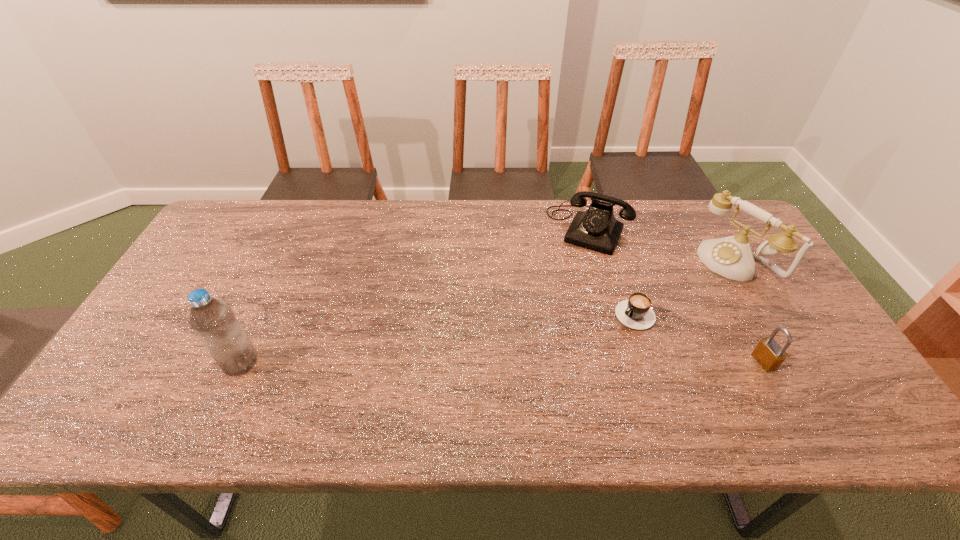
The image size is (960, 540). What are the coordinates of `vacant point located 0.110m on the dial of the right telephone` in the screenshot? It's located at (691, 293).

This screenshot has width=960, height=540. What are the coordinates of `free point located on the dial of the right telephone` in the screenshot? It's located at (703, 286).

Find the location of a particular element. vacant space located on the dial of the right telephone is located at coordinates (618, 340).

Where is `vacant space located on the front face of the left telephone`? This screenshot has height=540, width=960. vacant space located on the front face of the left telephone is located at coordinates (551, 308).

This screenshot has height=540, width=960. In order to click on vacant space located 0.050m on the front face of the left telephone in this screenshot , I will do `click(573, 263)`.

Locate an element on the screen. Image resolution: width=960 pixels, height=540 pixels. vacant space located 0.250m on the front face of the left telephone is located at coordinates (551, 308).

Find the location of a particular element. This screenshot has height=540, width=960. free space located 0.120m with the handle on the side of the third farthest object is located at coordinates (591, 346).

Where is `free spot located with the handle on the side of the third farthest object`? free spot located with the handle on the side of the third farthest object is located at coordinates (543, 379).

Where is `free spot located 0.210m with the handle on the side of the third farthest object`? This screenshot has width=960, height=540. free spot located 0.210m with the handle on the side of the third farthest object is located at coordinates (565, 364).

What are the coordinates of `water bottle present at the near edge` in the screenshot? It's located at pyautogui.click(x=213, y=320).